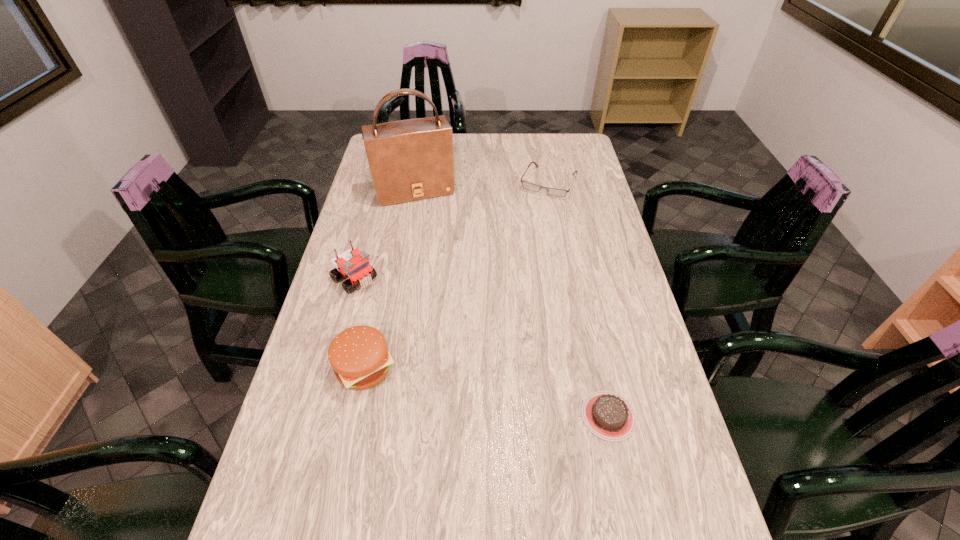
Find the location of a particular element. This screenshot has height=540, width=960. the third tallest object is located at coordinates (359, 356).

Find the location of a particular element. the shortest object is located at coordinates (608, 415).

Identify the location of shoulder bag. (409, 160).

Find the location of a particular element. Image resolution: width=960 pixels, height=540 pixels. the third farthest object is located at coordinates (354, 264).

I want to click on the fourth shortest object, so 354,264.

At what (x,y) coordinates should I click in order to perform the action: click on spectacles. Please return your answer as a coordinate pair (x, y). Looking at the image, I should click on (529, 186).

Find the location of a particular element. free space located on the front of the hamburger is located at coordinates (340, 480).

Identify the location of blank space located 0.110m on the left of the chocolate cake. (535, 416).

The width and height of the screenshot is (960, 540). I want to click on blank area located 0.380m on the front flap of the shoulder bag, so click(448, 279).

You are a GUI agent. You are given a task and a screenshot of the screen. Output one action in this format:
    pyautogui.click(x=<x>, y=<y>)
    Task: Click on the free region located 0.150m on the front flap of the shoulder bag
    Image resolution: width=960 pixels, height=540 pixels.
    Given the screenshot: What is the action you would take?
    pyautogui.click(x=432, y=233)